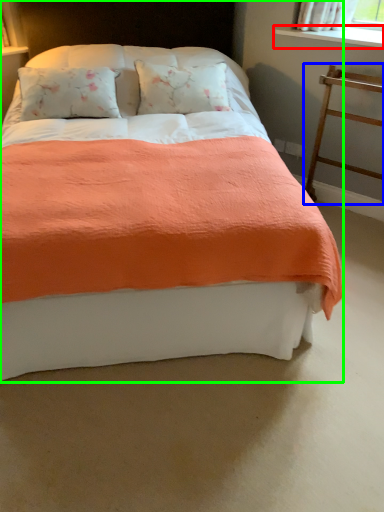
Question: Which object is the closest to the window sill (highlighted by a red box)? Choose among these: balustrade (highlighted by a blue box) or bed (highlighted by a green box).

Choices:
 (A) balustrade
 (B) bed

Answer: (A)